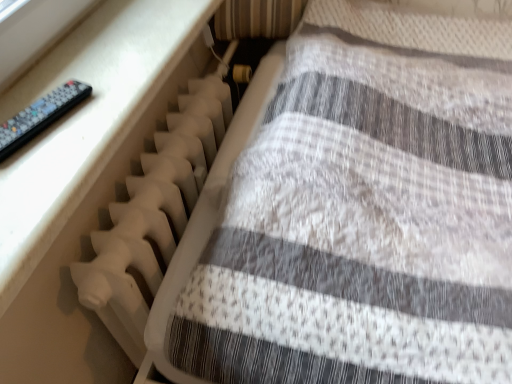
Measure the distance between black plastic remote at left and camera.

black plastic remote at left is 24.95 inches away from camera.

The height and width of the screenshot is (384, 512). In order to click on black plastic remote at left in this screenshot , I will do (40, 116).

How different are the orientations of white plastic radiator at left and white plastic radiator at lower left in degrees?

The angular difference between white plastic radiator at left and white plastic radiator at lower left is 91 degrees.

Does white plastic radiator at left appear on the left side of white plastic radiator at lower left?

Correct, you'll find white plastic radiator at left to the left of white plastic radiator at lower left.

In terms of height, does white plastic radiator at left look taller or shorter compared to white plastic radiator at lower left?

In the image, white plastic radiator at left appears to be shorter than white plastic radiator at lower left.

From the image's perspective, which is below, white plastic radiator at lower left or white plastic radiator at left?

white plastic radiator at left appears lower in the image.

Identify the location of radiator that is behind the white plastic radiator at lower left. (153, 214).

Is point (362, 183) positioned in front of point (126, 226)?

Yes, point (362, 183) is closer to viewer.

Is white plastic radiator at left looking in the opposite direction of black plastic remote at left?

No, white plastic radiator at left is not facing away from black plastic remote at left.

Is point (98, 237) farther from camera compared to point (67, 104)?

Yes, it is.

Consider the image. From a real-world perspective, is white plastic radiator at left physically below black plastic remote at left?

Yes, from a real-world perspective, white plastic radiator at left is beneath black plastic remote at left.

Which of these two, white plastic radiator at left or black plastic remote at left, is smaller?

With smaller size is black plastic remote at left.

Considering the positions of objects black plastic remote at left and white plastic radiator at lower left in the image provided, who is in front, black plastic remote at left or white plastic radiator at lower left?

white plastic radiator at lower left is closer to the camera.

Choose the correct answer: Is black plastic remote at left inside white plastic radiator at lower left or outside it?

black plastic remote at left exists outside the volume of white plastic radiator at lower left.

Which object is positioned more to the right, black plastic remote at left or white plastic radiator at lower left?

Positioned to the right is white plastic radiator at lower left.

Is black plastic remote at left located within white plastic radiator at lower left?

Definitely not — black plastic remote at left is not inside white plastic radiator at lower left.

Is white plastic radiator at lower left looking in the opposite direction of black plastic remote at left?

No, black plastic remote at left is not at the back of white plastic radiator at lower left.

From the image's perspective, is white plastic radiator at lower left on black plastic remote at left?

No.

Can you confirm if white plastic radiator at lower left is wider than black plastic remote at left?

Correct, the width of white plastic radiator at lower left exceeds that of black plastic remote at left.

From the image's perspective, is black plastic remote at left positioned above or below white plastic radiator at left?

Based on their image positions, black plastic remote at left is located above white plastic radiator at left.

Find the location of a particular element. The height and width of the screenshot is (384, 512). control that appears above the white plastic radiator at left (from a real-world perspective) is located at coordinates (40, 116).

Is point (61, 115) closer to viewer compared to point (227, 101)?

That is True.

Where is `furniture on the right of white plastic radiator at left`? The image size is (512, 384). furniture on the right of white plastic radiator at left is located at coordinates (357, 211).

Locate an element on the screen. Image resolution: width=512 pixels, height=384 pixels. radiator on the left of white plastic radiator at lower left is located at coordinates (153, 214).

From the image, which object appears to be farther from black plastic remote at left, white plastic radiator at left or white plastic radiator at lower left?

white plastic radiator at lower left.

Based on their spatial positions, is white plastic radiator at lower left or black plastic remote at left closer to white plastic radiator at left?

white plastic radiator at lower left is closer to white plastic radiator at left.

Considering their positions, is black plastic remote at left positioned closer to white plastic radiator at lower left than white plastic radiator at left?

white plastic radiator at left is positioned closer to the anchor white plastic radiator at lower left.

When comparing their distances from black plastic remote at left, does white plastic radiator at lower left or white plastic radiator at left seem further?

white plastic radiator at lower left is positioned further to the anchor black plastic remote at left.

Based on their spatial positions, is white plastic radiator at left or black plastic remote at left closer to white plastic radiator at lower left?

The object closer to white plastic radiator at lower left is white plastic radiator at left.

Estimate the real-world distances between objects in this image. Which object is closer to white plastic radiator at left, black plastic remote at left or white plastic radiator at lower left?

white plastic radiator at lower left is positioned closer to the anchor white plastic radiator at left.

Locate an element on the screen. radiator between black plastic remote at left and white plastic radiator at lower left from left to right is located at coordinates (153, 214).